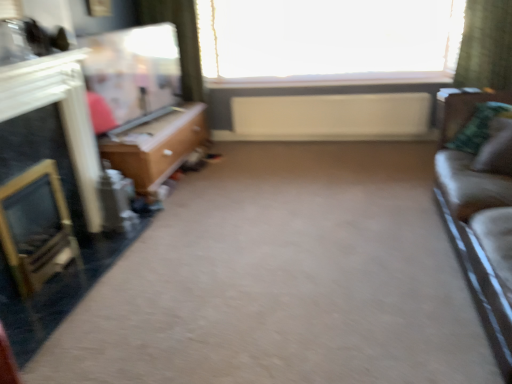
Locate an element on the screen. The width and height of the screenshot is (512, 384). empty space that is to the right of white glossy fireplace at left is located at coordinates (132, 253).